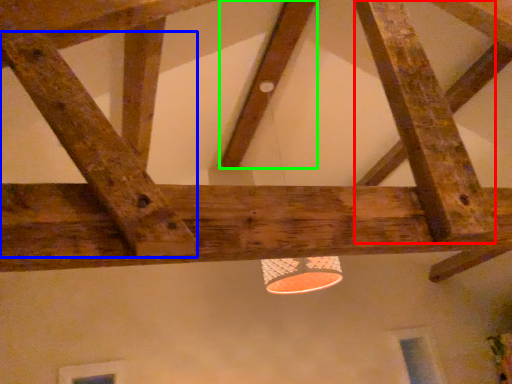
Question: Which object is positioned closest to plank (highlighted by a red box)? Select from plank (highlighted by a blue box) and plank (highlighted by a green box).

Choices:
 (A) plank
 (B) plank

Answer: (A)